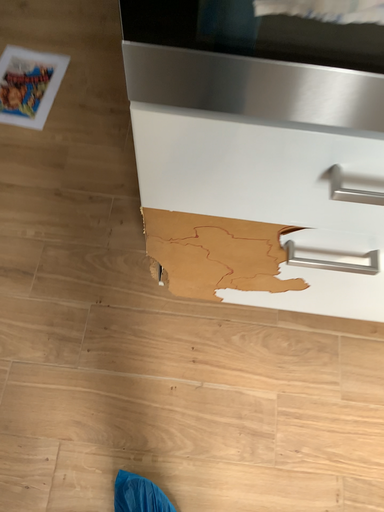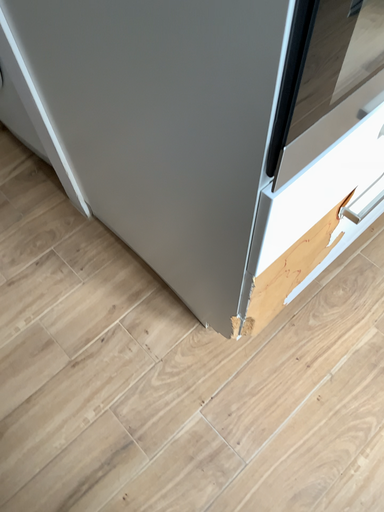
Question: Which way did the camera rotate in the video?

Choices:
 (A) rotated left
 (B) rotated right

Answer: (B)